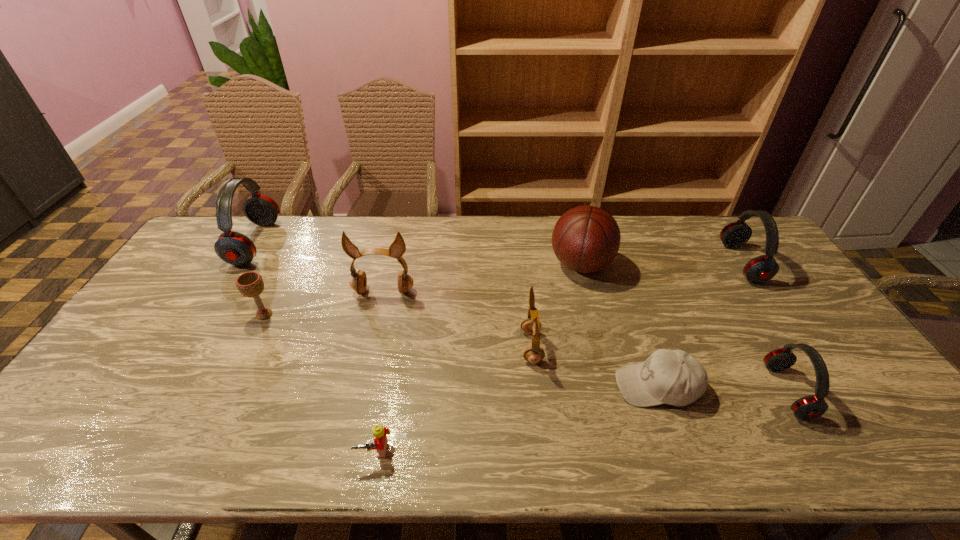
In the image, there is a desktop. At what (x,y) coordinates should I click in order to perform the action: click on vacant space at the far right corner. Please return your answer as a coordinate pair (x, y). This screenshot has height=540, width=960. Looking at the image, I should click on (706, 215).

The image size is (960, 540). I want to click on free space at the near right corner of the desktop, so click(850, 436).

You are a GUI agent. You are given a task and a screenshot of the screen. Output one action in this format:
    pyautogui.click(x=<x>, y=<y>)
    Task: Click on the empty location between the gray baseball cap and the second earphone from left to right
    The width and height of the screenshot is (960, 540).
    Given the screenshot: What is the action you would take?
    pyautogui.click(x=520, y=339)

Identify the location of free point between the biggest red earphone and the basketball. This screenshot has height=540, width=960. (418, 254).

The height and width of the screenshot is (540, 960). Find the location of `free space between the Lego and the chalice`. free space between the Lego and the chalice is located at coordinates 320,383.

Find the location of a particular element. vacant space that is in between the nearest object and the baseball cap is located at coordinates (516, 418).

Locate an element on the screen. The width and height of the screenshot is (960, 540). vacant area that lies between the smallest red earphone and the second biggest red earphone is located at coordinates (764, 327).

This screenshot has height=540, width=960. Identify the location of empty space that is in between the smallest red earphone and the farther brown earphone. (586, 341).

You are a GUI agent. You are given a task and a screenshot of the screen. Output one action in this format:
    pyautogui.click(x=<x>, y=<y>)
    Task: Click on the free spot between the nearest object and the left brown earphone
    
    Given the screenshot: What is the action you would take?
    pyautogui.click(x=379, y=371)

The image size is (960, 540). Find the location of `vacant area that lies between the rightmost earphone and the second object from left to right`. vacant area that lies between the rightmost earphone and the second object from left to right is located at coordinates (503, 289).